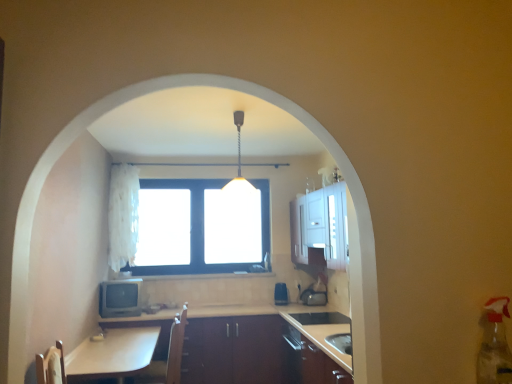
Question: Is white glossy table at lower left in front of or behind brown leather swivel chair at lower left in the image?

Choices:
 (A) front
 (B) behind

Answer: (A)

Question: Based on their sizes in the image, would you say white glossy table at lower left is bigger or smaller than brown leather swivel chair at lower left?

Choices:
 (A) big
 (B) small

Answer: (A)

Question: Which object is positioned closest to the brown leather swivel chair at lower left?

Choices:
 (A) clear glass window at center
 (B) metallic pendant light at center
 (C) wooden at center
 (D) matte gray television at lower left, the 1th appliance positioned from the front
 (E) white fluffy curtain at upper left

Answer: (D)

Question: Estimate the real-world distances between objects in this image. Which object is closer to the clear glass window at center?

Choices:
 (A) wooden at center
 (B) white fluffy curtain at upper left
 (C) metallic pendant light at center
 (D) blue plastic toaster at center, the first appliance viewed from the back
 (E) white glossy table at lower left

Answer: (B)